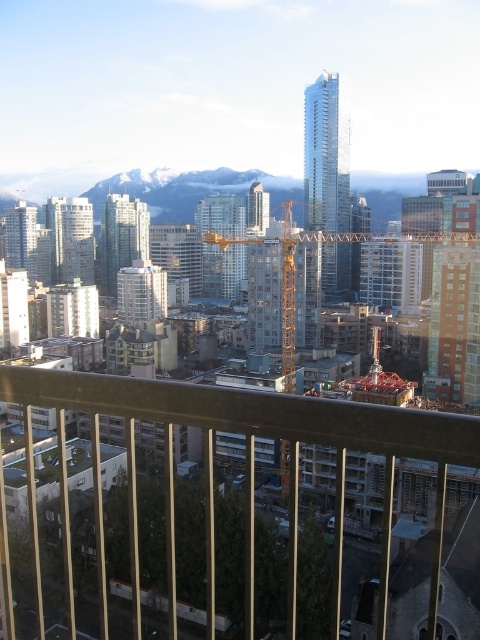
Question: Which object appears closest to the camera in this image?

Choices:
 (A) yellow metallic crane at center
 (B) metal construction crane at center

Answer: (B)

Question: Can you confirm if metal construction crane at center is bigger than yellow metallic crane at center?

Choices:
 (A) no
 (B) yes

Answer: (A)

Question: Which object appears farthest from the camera in this image?

Choices:
 (A) metal construction crane at center
 (B) yellow metallic crane at center

Answer: (B)

Question: Where is metal construction crane at center located in relation to yellow metallic crane at center in the image?

Choices:
 (A) below
 (B) above

Answer: (A)

Question: Does metal construction crane at center lie behind yellow metallic crane at center?

Choices:
 (A) yes
 (B) no

Answer: (B)